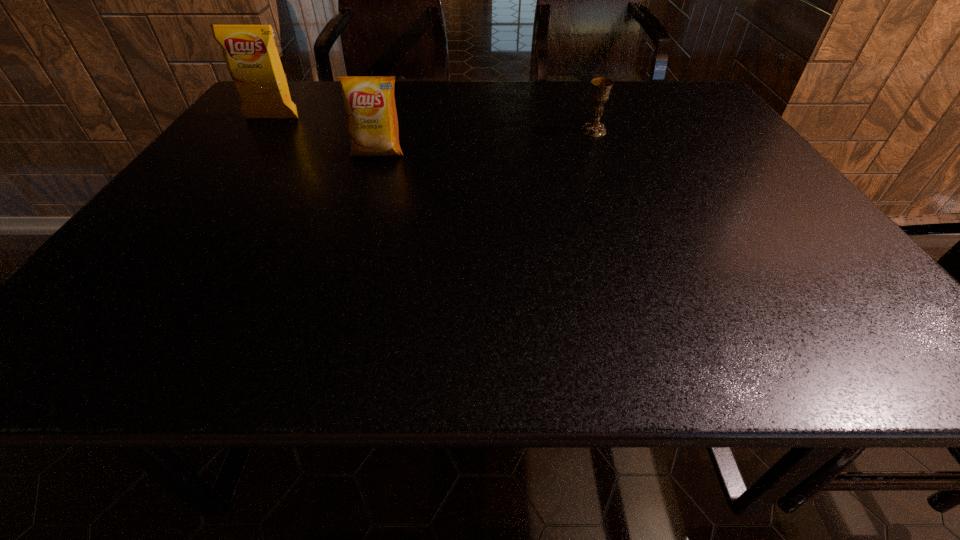
I want to click on the farther crisp (potato chip), so click(250, 52).

The height and width of the screenshot is (540, 960). In order to click on the leftmost object in this screenshot , I will do `click(250, 52)`.

Where is `the shorter crisp (potato chip)`? This screenshot has width=960, height=540. the shorter crisp (potato chip) is located at coordinates (369, 102).

This screenshot has width=960, height=540. Identify the location of the right crisp (potato chip). (369, 102).

The height and width of the screenshot is (540, 960). Identify the location of the second nearest object. (601, 87).

You are a GUI agent. You are given a task and a screenshot of the screen. Output one action in this format:
    pyautogui.click(x=<x>, y=<y>)
    Task: Click on the chalice
    This screenshot has height=540, width=960.
    Given the screenshot: What is the action you would take?
    pyautogui.click(x=601, y=87)

You are a GUI agent. You are given a task and a screenshot of the screen. Output one action in this format:
    pyautogui.click(x=<x>, y=<y>)
    Task: Click on the vacant space located on the front of the tallest object with the logo
    This screenshot has width=960, height=540.
    Given the screenshot: What is the action you would take?
    pyautogui.click(x=204, y=211)

The width and height of the screenshot is (960, 540). What are the coordinates of `free space located 0.080m on the front-facing side of the right crisp (potato chip)` in the screenshot? It's located at (369, 180).

At what (x,y) coordinates should I click in order to perform the action: click on free region located 0.130m on the left of the chalice. Please return your answer as a coordinate pair (x, y). Looking at the image, I should click on tap(532, 131).

In order to click on object that is at the far edge in this screenshot , I will do `click(250, 52)`.